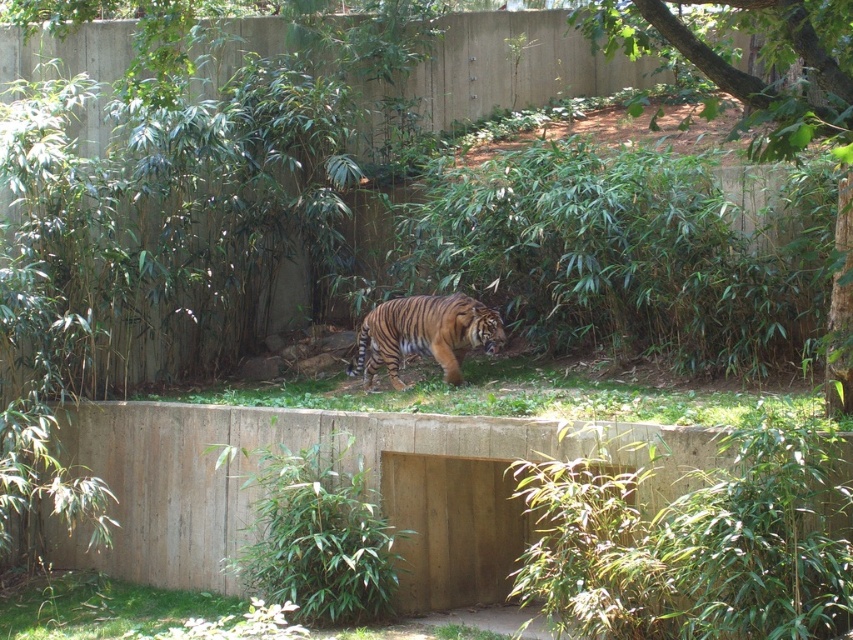
Question: Can you confirm if concrete at center is positioned below orange striped tiger at center?

Choices:
 (A) no
 (B) yes

Answer: (B)

Question: Which of the following is the farthest from the observer?

Choices:
 (A) (486, 444)
 (B) (422, 312)

Answer: (B)

Question: Does concrete at center have a greater width compared to orange striped tiger at center?

Choices:
 (A) yes
 (B) no

Answer: (A)

Question: Is concrete at center thinner than orange striped tiger at center?

Choices:
 (A) yes
 (B) no

Answer: (B)